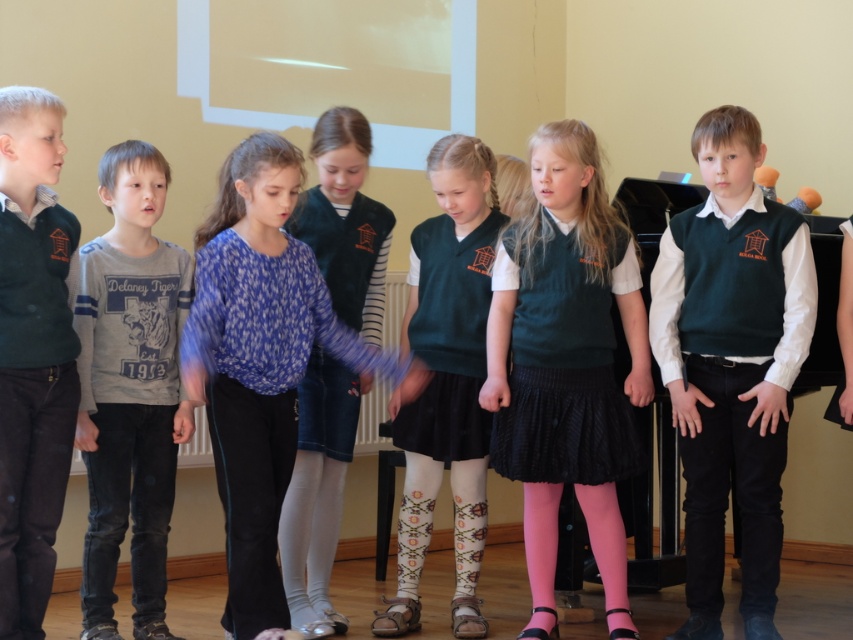
Question: Which point appears closest to the camera in this image?

Choices:
 (A) (786, 412)
 (B) (38, 193)
 (C) (328, 360)

Answer: (B)

Question: In this image, where is green matte vest at center located relative to blue printed blouse at center?

Choices:
 (A) above
 (B) below

Answer: (A)

Question: Is blue printed blouse at center above matte blue dress at center?

Choices:
 (A) no
 (B) yes

Answer: (A)

Question: Which point is closer to the camera?

Choices:
 (A) (131, 356)
 (B) (39, 120)
 (C) (242, 300)
 (D) (799, 280)

Answer: (B)

Question: Can you confirm if blue printed blouse at center is wider than matte green vest at center?

Choices:
 (A) yes
 (B) no

Answer: (A)

Question: Which point appears closest to the camera in this image?

Choices:
 (A) click(466, 531)
 (B) click(697, 586)
 (C) click(282, 570)

Answer: (B)